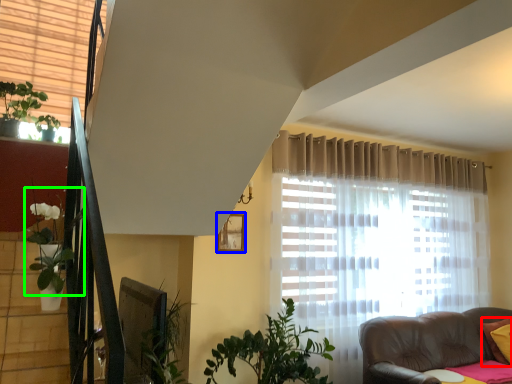
Question: Based on their relative distances, which object is farther from pillow (highlighted by a red box)? Choose from picture frame (highlighted by a blue box) and plant (highlighted by a green box).

Choices:
 (A) picture frame
 (B) plant

Answer: (B)